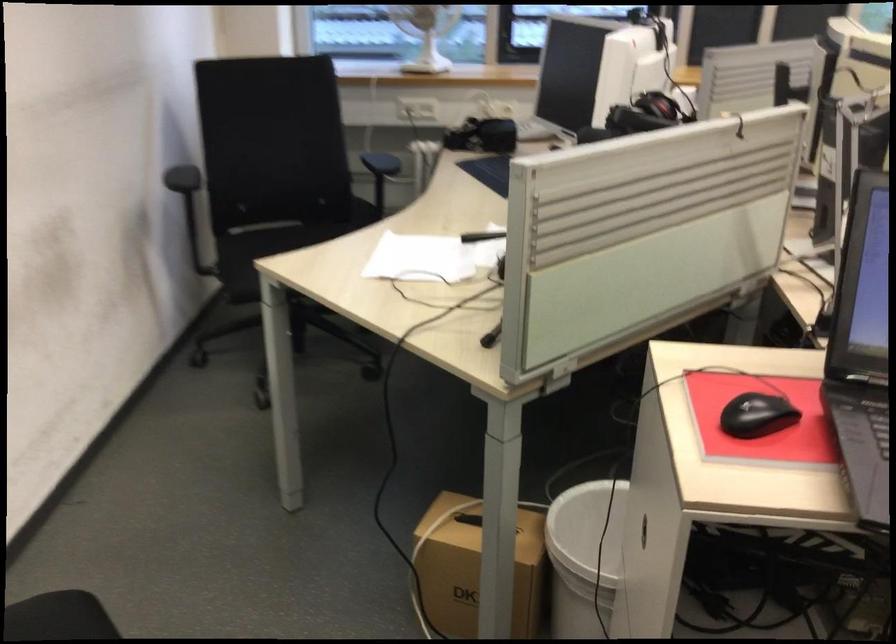
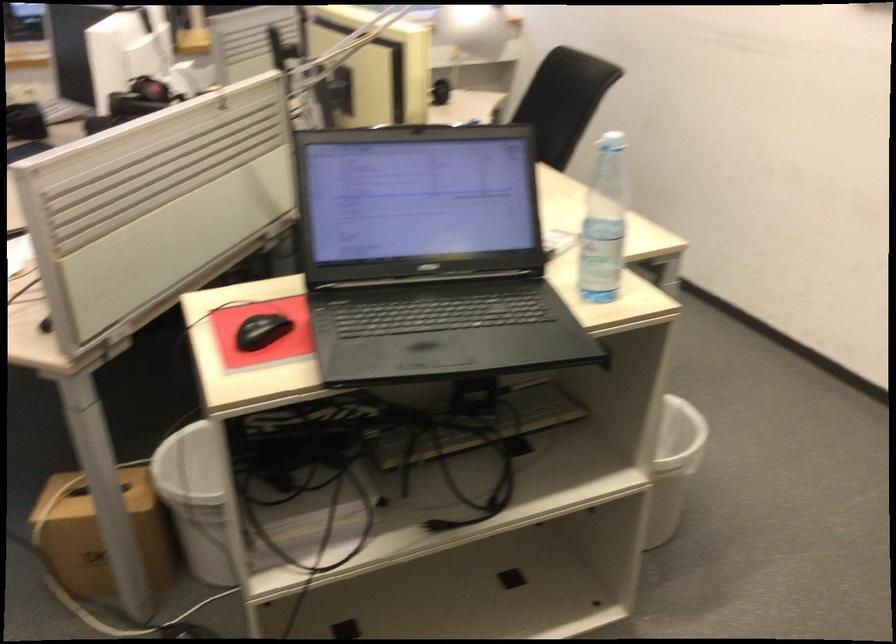
Where in the second image is the point corresponding to the point at 470,570 from the first image?

(100, 534)